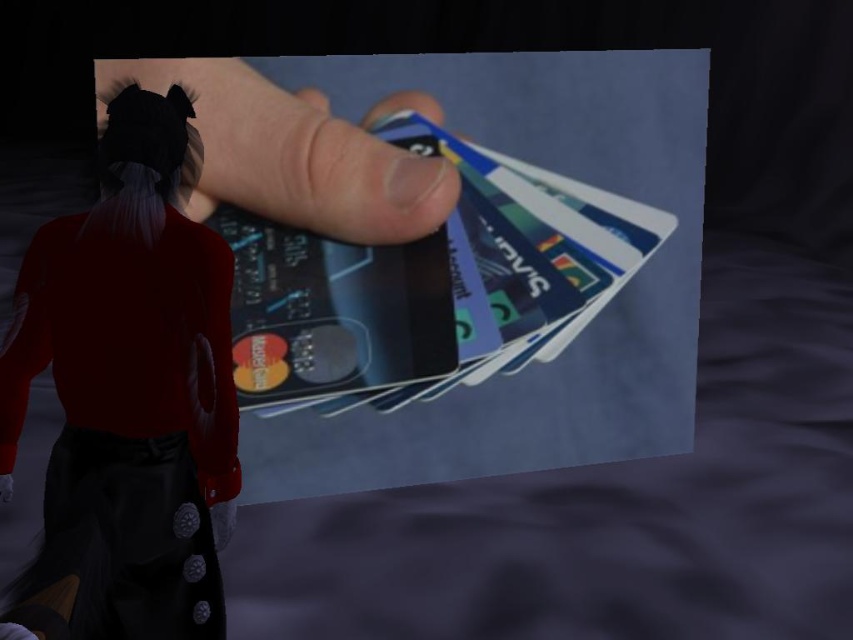
Is silky black hair at upper left thinner than smooth skin hand at center?

Correct, silky black hair at upper left's width is less than smooth skin hand at center's.

Does silky black hair at upper left appear on the right side of smooth skin hand at center?

No, silky black hair at upper left is not to the right of smooth skin hand at center.

Does point (184, 541) come farther from viewer compared to point (207, 196)?

No, (184, 541) is in front of (207, 196).

At what (x,y) coordinates should I click in order to perform the action: click on silky black hair at upper left. Please return your answer as a coordinate pair (x, y). This screenshot has width=853, height=640. Looking at the image, I should click on (126, 394).

Which of these two, smooth skin hand at center or metallic blue credit card at center, stands taller?

With more height is metallic blue credit card at center.

What are the coordinates of `smooth skin hand at center` in the screenshot? It's located at (296, 152).

Between point (33, 260) and point (465, 188), which one is positioned behind?

Positioned behind is point (465, 188).

Does point (80, 339) come closer to viewer compared to point (534, 205)?

Yes, it is.

Identify the location of silky black hair at upper left. The width and height of the screenshot is (853, 640). coord(126,394).